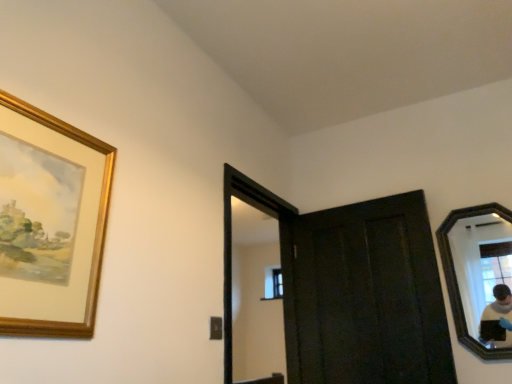
Question: Does black wooden mirror at right come behind gold-framed painting at upper left?

Choices:
 (A) no
 (B) yes

Answer: (B)

Question: Is black wooden mirror at right outside of gold-framed painting at upper left?

Choices:
 (A) yes
 (B) no

Answer: (A)

Question: Considering the relative sizes of black wooden mirror at right and gold-framed painting at upper left in the image provided, is black wooden mirror at right thinner than gold-framed painting at upper left?

Choices:
 (A) yes
 (B) no

Answer: (B)

Question: Can you confirm if black wooden mirror at right is bigger than gold-framed painting at upper left?

Choices:
 (A) no
 (B) yes

Answer: (B)

Question: Is black wooden mirror at right positioned far away from gold-framed painting at upper left?

Choices:
 (A) no
 (B) yes

Answer: (B)

Question: Is black wooden mirror at right shorter than gold-framed painting at upper left?

Choices:
 (A) no
 (B) yes

Answer: (A)

Question: Does black wooden mirror at right have a lesser height compared to clear glass window at center?

Choices:
 (A) yes
 (B) no

Answer: (B)

Question: From a real-world perspective, is black wooden mirror at right on top of clear glass window at center?

Choices:
 (A) yes
 (B) no

Answer: (B)

Question: Can you confirm if black wooden mirror at right is smaller than clear glass window at center?

Choices:
 (A) yes
 (B) no

Answer: (B)

Question: Is the position of black wooden mirror at right less distant than that of clear glass window at center?

Choices:
 (A) yes
 (B) no

Answer: (A)

Question: Is black wooden mirror at right oriented towards clear glass window at center?

Choices:
 (A) yes
 (B) no

Answer: (B)

Question: From a real-world perspective, is black wooden mirror at right located beneath clear glass window at center?

Choices:
 (A) no
 (B) yes

Answer: (B)

Question: Is dark wood door at center not inside clear glass window at center?

Choices:
 (A) no
 (B) yes

Answer: (B)